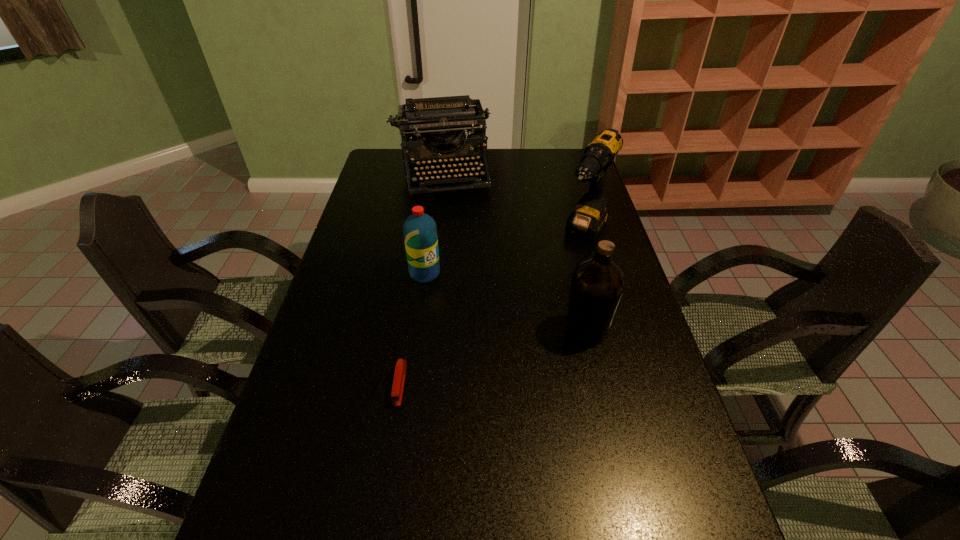
At what (x,y) coordinates should I click in order to perform the action: click on free spot on the desktop that is between the shortest object and the olive oil and is positioned on the front label of the third nearest object. Please return your answer as a coordinate pair (x, y). This screenshot has width=960, height=540. Looking at the image, I should click on (480, 361).

Locate an element on the screen. The width and height of the screenshot is (960, 540). free space on the desktop that is between the shortest object and the fourth farthest object and is positioned at the tip of the drill is located at coordinates (516, 351).

Image resolution: width=960 pixels, height=540 pixels. Find the location of `vacant space on the desktop that is between the nearest object and the olive oil and is positioned on the typing side of the farthest object`. vacant space on the desktop that is between the nearest object and the olive oil and is positioned on the typing side of the farthest object is located at coordinates (480, 362).